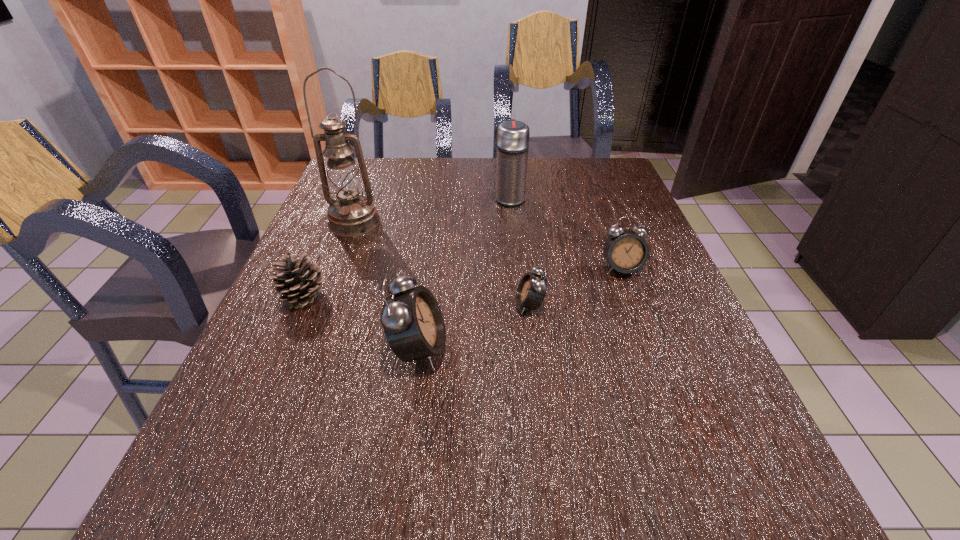
You are a GUI agent. You are given a task and a screenshot of the screen. Output one action in this format:
    pyautogui.click(x=<x>, y=<y>)
    Task: Click on the vacant region located 0.080m on the back of the pinecone
    The height and width of the screenshot is (540, 960).
    Given the screenshot: What is the action you would take?
    pyautogui.click(x=321, y=258)

Where is `object that is at the far edge`? object that is at the far edge is located at coordinates coord(512,136).

This screenshot has width=960, height=540. Identify the location of oil lamp present at the left edge. (351, 214).

I want to click on pinecone that is at the left edge, so click(x=299, y=280).

What are the coordinates of `object at the right edge` in the screenshot? It's located at (627, 252).

I want to click on vacant space at the far edge of the desktop, so click(x=540, y=193).

What are the coordinates of `blank area at the near edge` in the screenshot? It's located at (380, 420).

In the image, there is a desktop. At what (x,y) coordinates should I click in order to perform the action: click on vacant space at the left edge. Please return your answer as a coordinate pair (x, y). The height and width of the screenshot is (540, 960). Looking at the image, I should click on (331, 347).

Where is `vacant area at the right edge of the desktop`? This screenshot has width=960, height=540. vacant area at the right edge of the desktop is located at coordinates (645, 395).

In the image, there is a desktop. At what (x,y) coordinates should I click in order to perform the action: click on vacant region at the far right corner. Please return your answer as a coordinate pair (x, y). The height and width of the screenshot is (540, 960). Looking at the image, I should click on (607, 160).